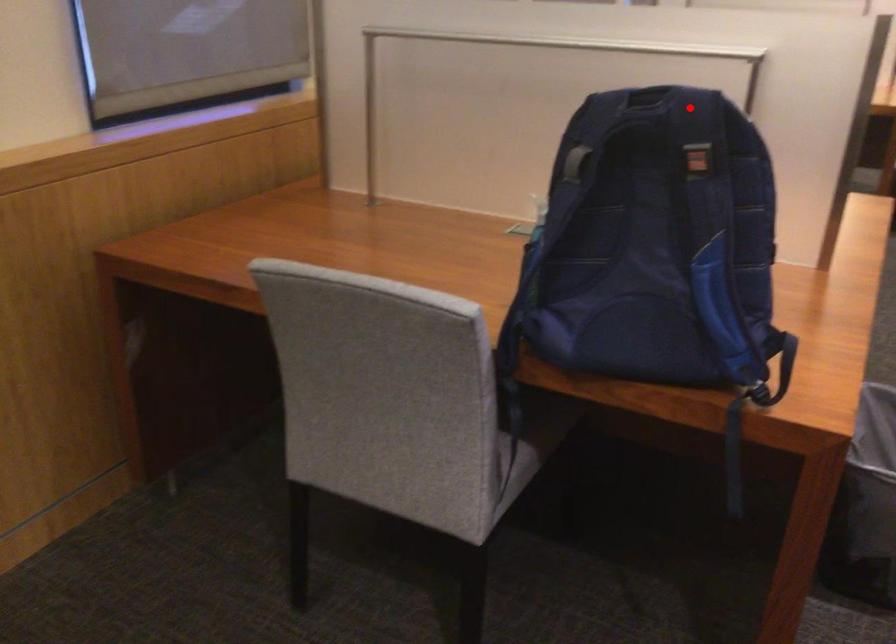
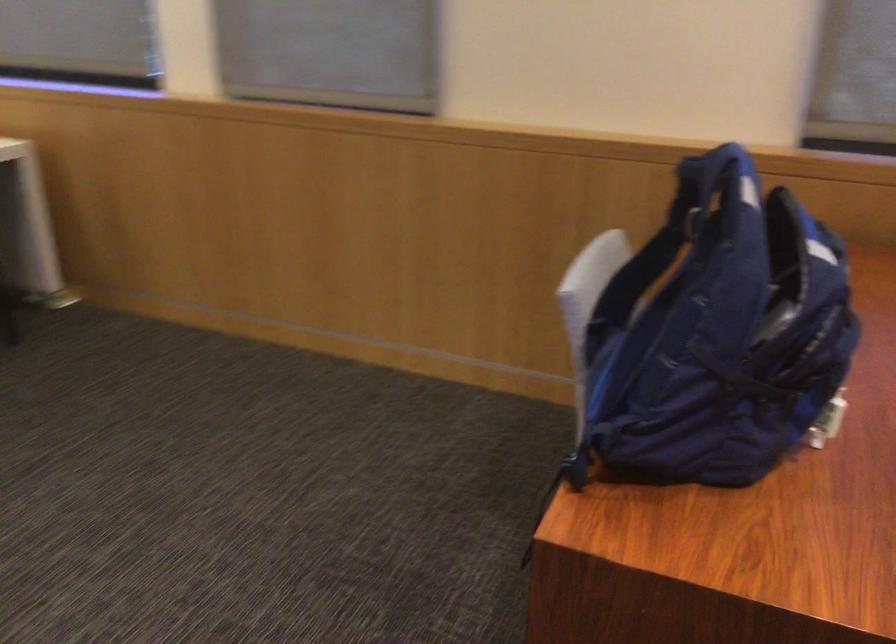
Question: I am providing you with two images of the same scene from different viewpoints. A red point is shown in image1. For the corresponding object point in image2, is it positioned nearer or farther from the camera?

Choices:
 (A) Nearer
 (B) Farther

Answer: (A)